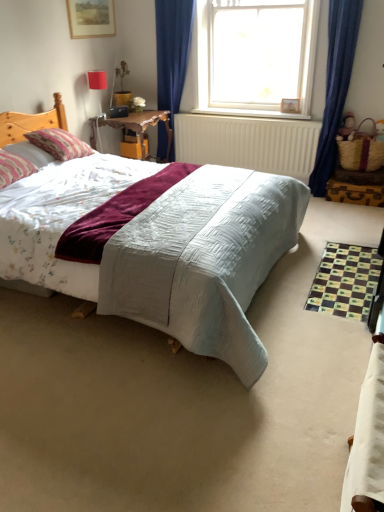
Question: Is wooden picture frame at upper left to the right of pink striped pillow at left, which is counted as the 2th pillow, starting from the back, from the viewer's perspective?

Choices:
 (A) no
 (B) yes

Answer: (B)

Question: From a real-world perspective, is wooden picture frame at upper left under pink striped pillow at left, which is counted as the 2th pillow, starting from the back?

Choices:
 (A) no
 (B) yes

Answer: (A)

Question: Is wooden picture frame at upper left further to the viewer compared to pink striped pillow at left, which is counted as the 2th pillow, starting from the back?

Choices:
 (A) yes
 (B) no

Answer: (A)

Question: Would you consider wooden picture frame at upper left to be distant from pink striped pillow at left, which is counted as the 2th pillow, starting from the back?

Choices:
 (A) no
 (B) yes

Answer: (B)

Question: Is wooden picture frame at upper left placed right next to pink striped pillow at left, which is counted as the 2th pillow, starting from the back?

Choices:
 (A) yes
 (B) no

Answer: (B)

Question: From the image's perspective, is wooden picture frame at upper left under pink striped pillow at left, which is counted as the 1th pillow, starting from the front?

Choices:
 (A) no
 (B) yes

Answer: (A)

Question: From a real-world perspective, is wooden table at center under transparent glass window at upper center?

Choices:
 (A) no
 (B) yes

Answer: (B)

Question: Does wooden table at center have a larger size compared to transparent glass window at upper center?

Choices:
 (A) yes
 (B) no

Answer: (B)

Question: Does wooden table at center have a smaller size compared to transparent glass window at upper center?

Choices:
 (A) no
 (B) yes

Answer: (B)

Question: Is wooden table at center further to the viewer compared to transparent glass window at upper center?

Choices:
 (A) yes
 (B) no

Answer: (A)

Question: Is wooden table at center oriented away from transparent glass window at upper center?

Choices:
 (A) no
 (B) yes

Answer: (A)

Question: From a real-world perspective, does wooden table at center stand above transparent glass window at upper center?

Choices:
 (A) no
 (B) yes

Answer: (A)

Question: Is the position of transparent glass window at upper center more distant than that of pink striped pillow at left, which is counted as the 2th pillow, starting from the back?

Choices:
 (A) no
 (B) yes

Answer: (B)